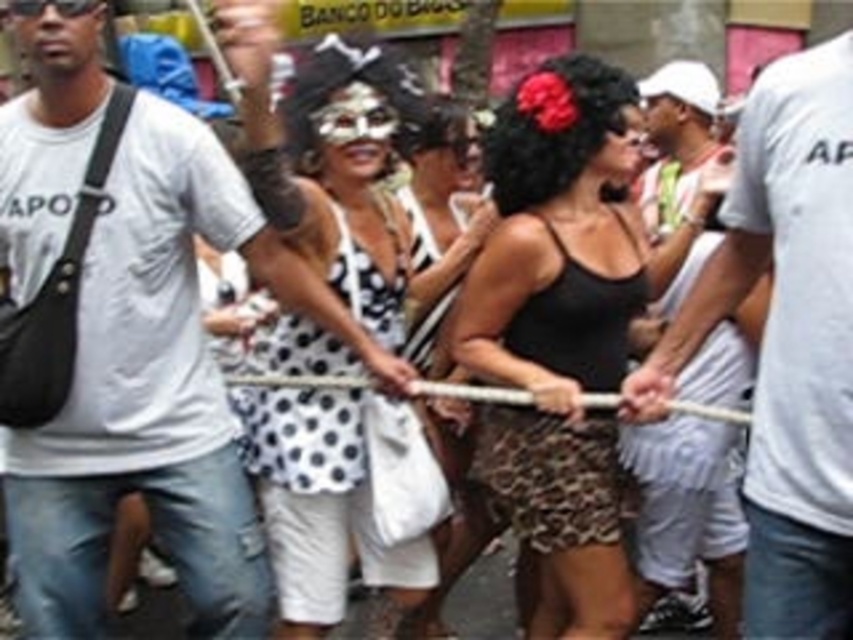
Question: Among these points, which one is farthest from the camera?

Choices:
 (A) (427, 628)
 (B) (248, 182)
 (C) (556, 387)
 (D) (132, 368)

Answer: (A)

Question: Which of the following is the closest to the observer?

Choices:
 (A) black satin dress at center
 (B) black matte tank top at center
 (C) white cotton t-shirt at center

Answer: (C)

Question: Based on their relative distances, which object is nearer to the white cotton t-shirt at center?

Choices:
 (A) black matte tank top at center
 (B) white dotted dress at center

Answer: (B)

Question: Can you confirm if white cotton shirt at center is wider than black satin dress at center?

Choices:
 (A) yes
 (B) no

Answer: (A)

Question: Can you confirm if white cotton t-shirt at center is smaller than black matte tank top at center?

Choices:
 (A) no
 (B) yes

Answer: (A)

Question: In this image, where is white dotted dress at center located relative to white cotton shirt at center?

Choices:
 (A) below
 (B) above

Answer: (B)